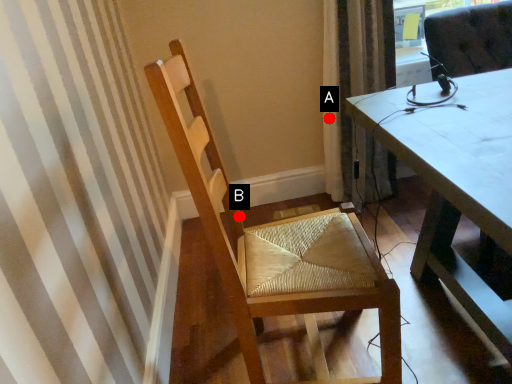
Question: Two points are circled on the image, labeled by A and B beside each circle. Which point appears farthest from the camera in this image?

Choices:
 (A) A is further
 (B) B is further

Answer: (A)